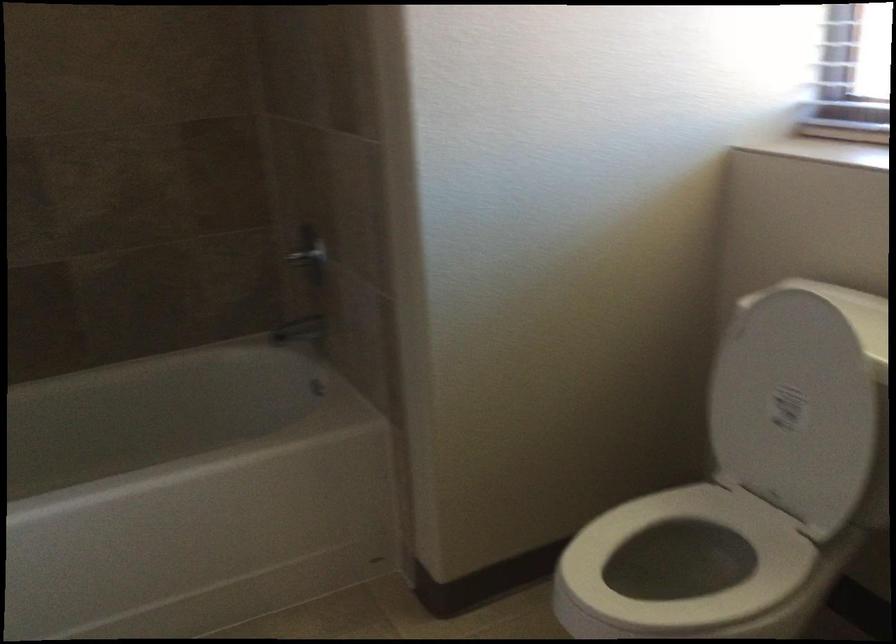
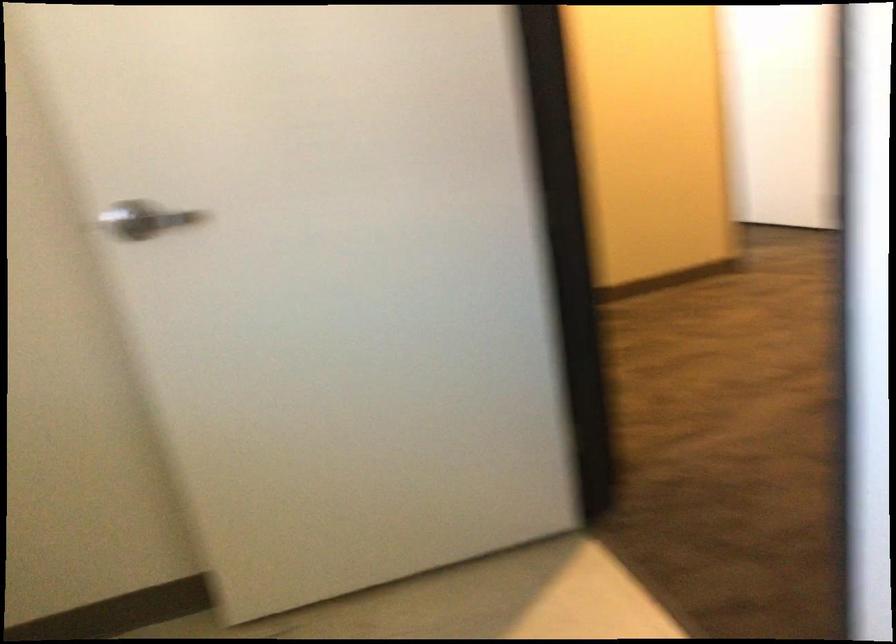
First-person continuous shooting, in which direction is the camera rotating?

The camera rotated toward right-down.